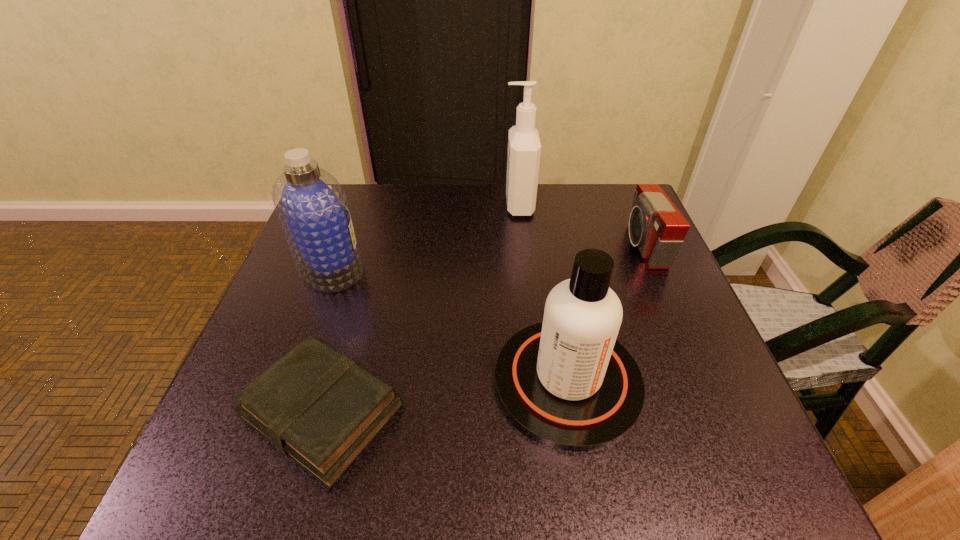
The image size is (960, 540). In order to click on unoccupied area between the leftmost cleansing agent and the shortest object in this screenshot , I will do `click(326, 339)`.

This screenshot has height=540, width=960. Identify the location of free spot between the camera and the second nearest cleansing agent. [487, 256].

Where is `vacant point located between the book and the fourth tallest object`? This screenshot has width=960, height=540. vacant point located between the book and the fourth tallest object is located at coordinates (483, 328).

Where is `vacant region between the shortest object and the nearest cleansing agent`? The image size is (960, 540). vacant region between the shortest object and the nearest cleansing agent is located at coordinates click(445, 396).

Find the location of a particular element. Image resolution: width=960 pixels, height=540 pixels. empty location between the nearest cleansing agent and the shortest object is located at coordinates (445, 396).

The width and height of the screenshot is (960, 540). I want to click on empty space between the farthest object and the book, so click(420, 308).

Where is `free area in between the shortest object and the leftmost cleansing agent`? This screenshot has width=960, height=540. free area in between the shortest object and the leftmost cleansing agent is located at coordinates (326, 339).

Where is `vacant space that is in between the nearest cleansing agent and the leftmost cleansing agent`? The width and height of the screenshot is (960, 540). vacant space that is in between the nearest cleansing agent and the leftmost cleansing agent is located at coordinates (449, 324).

I want to click on free space between the nearest cleansing agent and the farthest cleansing agent, so click(542, 293).

At what (x,y) coordinates should I click in order to perform the action: click on vacant region between the book and the nearest cleansing agent. Please return your answer as a coordinate pair (x, y). This screenshot has height=540, width=960. Looking at the image, I should click on (445, 396).